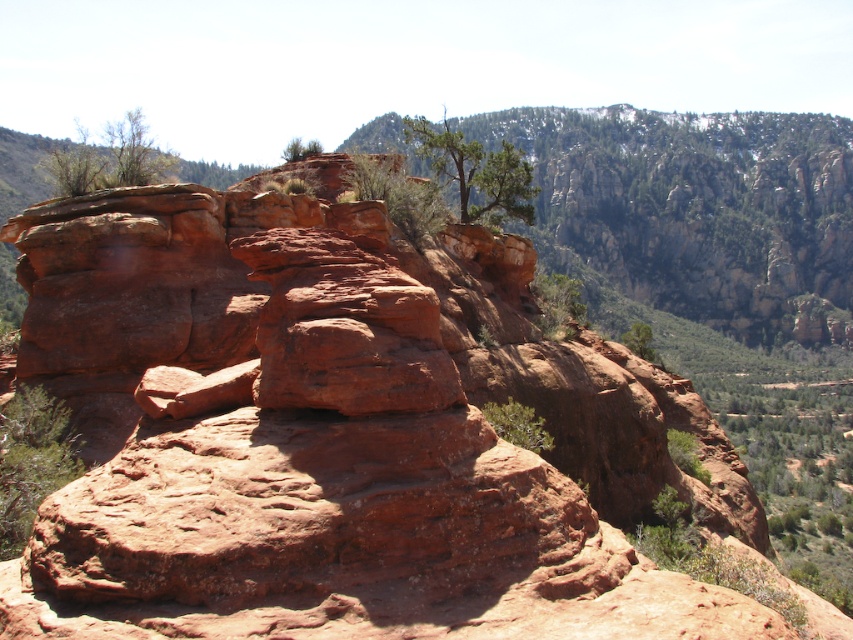
Question: Can you confirm if green leafy tree at upper left is wider than green leafy tree at center?

Choices:
 (A) no
 (B) yes

Answer: (B)

Question: Among these objects, which one is nearest to the camera?

Choices:
 (A) green textured tree at upper center
 (B) green leafy tree at lower left
 (C) green leafy shrub at upper left
 (D) green leafy tree at upper left

Answer: (B)

Question: Among these objects, which one is farthest from the camera?

Choices:
 (A) green leafy shrub at upper left
 (B) green leafy tree at upper left
 (C) green leafy tree at center
 (D) green textured tree at upper center

Answer: (D)

Question: Which object is the farthest from the green leafy shrub at upper left?

Choices:
 (A) green leafy tree at upper left
 (B) green textured tree at upper center
 (C) green leafy tree at lower left
 (D) green leafy tree at center

Answer: (C)

Question: Can you confirm if green textured tree at upper center is positioned to the right of green leafy tree at upper left?

Choices:
 (A) yes
 (B) no

Answer: (A)

Question: Is green leafy tree at upper left below green leafy tree at center?

Choices:
 (A) yes
 (B) no

Answer: (B)